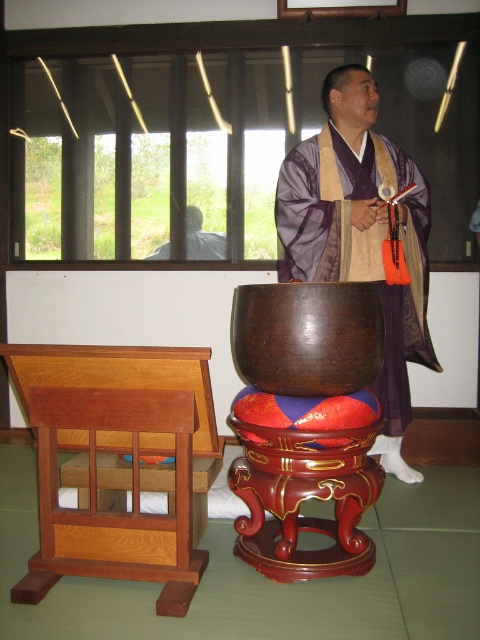
Which of these two, wooden altar at center or shiny lacquered stool at center, stands shorter?

With less height is shiny lacquered stool at center.

Can you confirm if wooden altar at center is positioned below shiny lacquered stool at center?

No, wooden altar at center is not below shiny lacquered stool at center.

Between point (104, 406) and point (289, 524), which one is positioned in front?

Positioned in front is point (104, 406).

This screenshot has height=640, width=480. I want to click on wooden altar at center, so click(x=126, y=465).

Between wooden altar at center and matte purple kimono at center, which one has more height?

With more height is matte purple kimono at center.

Between wooden altar at center and matte purple kimono at center, which one is positioned lower?

wooden altar at center is below.

Is point (141, 404) less distant than point (331, 90)?

That is True.

The width and height of the screenshot is (480, 640). What are the coordinates of `wooden altar at center` in the screenshot? It's located at (126, 465).

Is point (338, 96) positioned after point (294, 488)?

Yes, it is.

Is matte purple kimono at center taller than shiny lacquered stool at center?

Indeed, matte purple kimono at center has a greater height compared to shiny lacquered stool at center.

Is point (414, 280) behind point (332, 467)?

Yes, it is behind point (332, 467).

The width and height of the screenshot is (480, 640). Find the location of `matte purple kimono at center`. matte purple kimono at center is located at coordinates (360, 236).